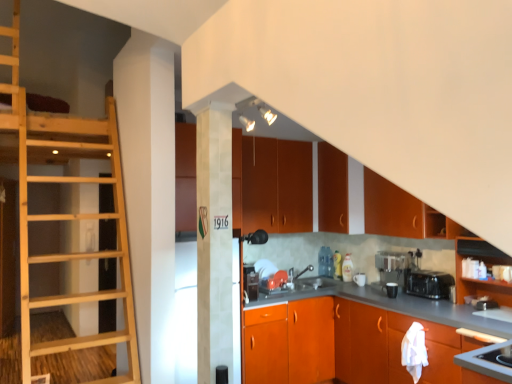
Question: Does natural wood ladder at left have a lesser height compared to matte black coffee maker at lower center, which is the third appliance in right-to-left order?

Choices:
 (A) yes
 (B) no

Answer: (B)

Question: Does natural wood ladder at left have a smaller size compared to matte black coffee maker at lower center, which is the fourth appliance in front-to-back order?

Choices:
 (A) no
 (B) yes

Answer: (A)

Question: From a real-world perspective, is natural wood ladder at left on matte black coffee maker at lower center, positioned as the first appliance in back-to-front order?

Choices:
 (A) yes
 (B) no

Answer: (A)

Question: Is natural wood ladder at left far away from matte black coffee maker at lower center, which is the fourth appliance in front-to-back order?

Choices:
 (A) yes
 (B) no

Answer: (A)

Question: Is natural wood ladder at left wider than matte black coffee maker at lower center, which is the third appliance in right-to-left order?

Choices:
 (A) yes
 (B) no

Answer: (A)

Question: From a real-world perspective, relative to orange matte cabinet at upper center, the 6th cabinetry positioned from the bottom, is matte wood cabinet at upper right, marked as the 4th cabinetry in a top-to-bottom arrangement, vertically above or below?

Choices:
 (A) above
 (B) below

Answer: (B)

Question: Is point (388, 183) closer or farther from the camera than point (376, 218)?

Choices:
 (A) closer
 (B) farther

Answer: (A)

Question: Considering the positions of matte wood cabinet at upper right, which ranks as the 3th cabinetry in bottom-to-top order, and orange matte cabinet at upper center, the 1th cabinetry when ordered from top to bottom, in the image, is matte wood cabinet at upper right, which ranks as the 3th cabinetry in bottom-to-top order, wider or thinner than orange matte cabinet at upper center, the 1th cabinetry when ordered from top to bottom,?

Choices:
 (A) wide
 (B) thin

Answer: (B)

Question: Considering the relative positions of matte wood cabinet at upper right, which ranks as the 3th cabinetry in bottom-to-top order, and orange matte cabinet at upper center, the 6th cabinetry positioned from the bottom, in the image provided, is matte wood cabinet at upper right, which ranks as the 3th cabinetry in bottom-to-top order, to the left or to the right of orange matte cabinet at upper center, the 6th cabinetry positioned from the bottom,?

Choices:
 (A) right
 (B) left

Answer: (A)

Question: From the image's perspective, relative to metallic silver toaster at lower right, which is the fourth appliance in left-to-right order, is matte wood cabinets at center, marked as the fourth cabinetry in a bottom-to-top arrangement, above or below?

Choices:
 (A) above
 (B) below

Answer: (A)

Question: Is matte wood cabinets at center, marked as the fourth cabinetry in a bottom-to-top arrangement, to the left or to the right of metallic silver toaster at lower right, which is the 4th appliance from back to front, in the image?

Choices:
 (A) right
 (B) left

Answer: (B)

Question: In terms of size, does matte wood cabinets at center, which ranks as the third cabinetry in top-to-bottom order, appear bigger or smaller than metallic silver toaster at lower right, which is the 1th appliance in right-to-left order?

Choices:
 (A) small
 (B) big

Answer: (B)

Question: Is point (264, 220) closer or farther from the camera than point (482, 309)?

Choices:
 (A) closer
 (B) farther

Answer: (B)

Question: Is point (394, 283) positioned closer to the camera than point (373, 182)?

Choices:
 (A) closer
 (B) farther

Answer: (A)

Question: From a real-world perspective, is matte black coffee maker at lower center, positioned as the first appliance in back-to-front order, physically located above or below orange matte cabinet at upper center, the 6th cabinetry positioned from the bottom?

Choices:
 (A) above
 (B) below

Answer: (B)